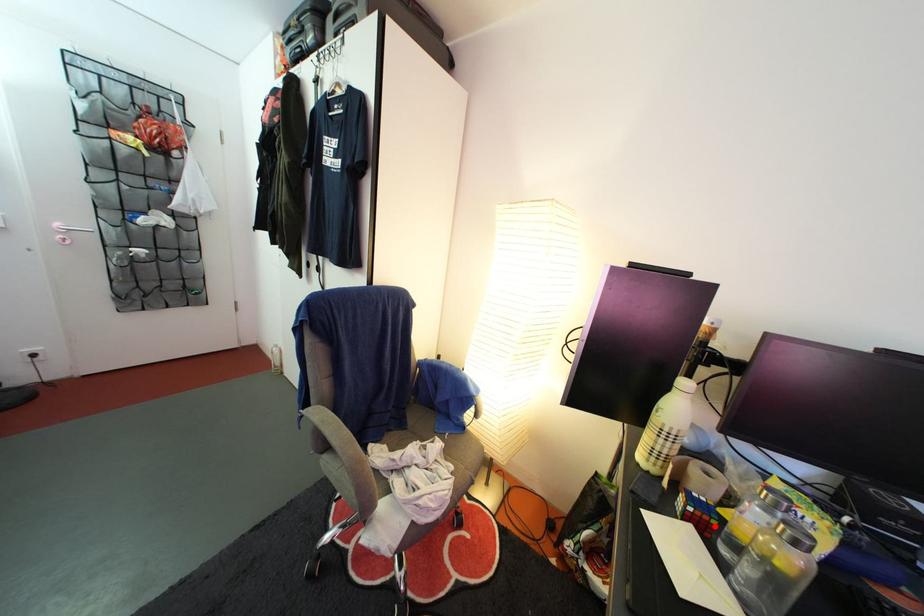
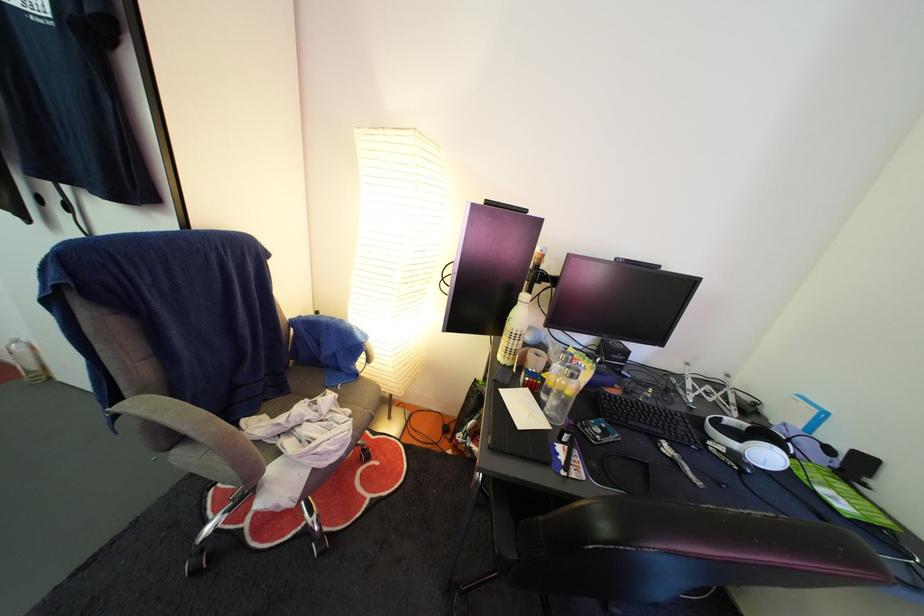
The point at the highlighted location is marked in the first image. Where is the corresponding point in the second image?

(543, 390)